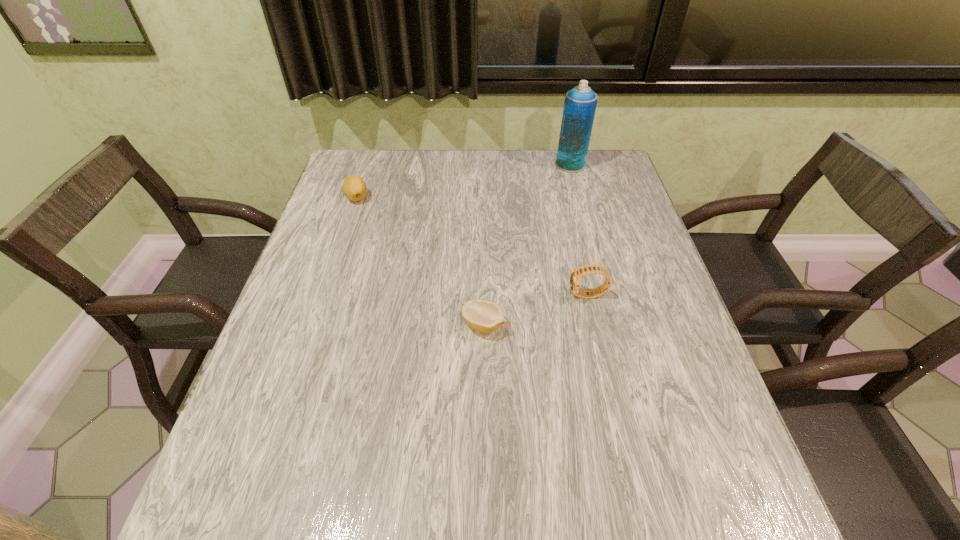
You are a GUI agent. You are given a task and a screenshot of the screen. Output one action in this format:
    pyautogui.click(x=<x>, y=<y>)
    Task: Click on the farthest object
    
    Given the screenshot: What is the action you would take?
    pyautogui.click(x=580, y=102)

Locate an element on the screen. This screenshot has width=960, height=540. the tallest object is located at coordinates (580, 102).

At what (x,y) coordinates should I click in order to perform the action: click on the third shortest object. Please return your answer as a coordinate pair (x, y). Looking at the image, I should click on (575, 276).

This screenshot has height=540, width=960. I want to click on watch, so click(x=575, y=276).

I want to click on the left lemon, so click(x=354, y=188).

This screenshot has height=540, width=960. I want to click on the farther lemon, so click(x=354, y=188).

Identify the location of the nearest object. (484, 316).

This screenshot has height=540, width=960. What are the coordinates of `the shortest object` in the screenshot? It's located at (484, 316).

Find the location of `free space located on the front of the farthest object`. free space located on the front of the farthest object is located at coordinates (581, 203).

The height and width of the screenshot is (540, 960). What are the coordinates of `free space located on the face of the second tallest object` in the screenshot? It's located at (398, 295).